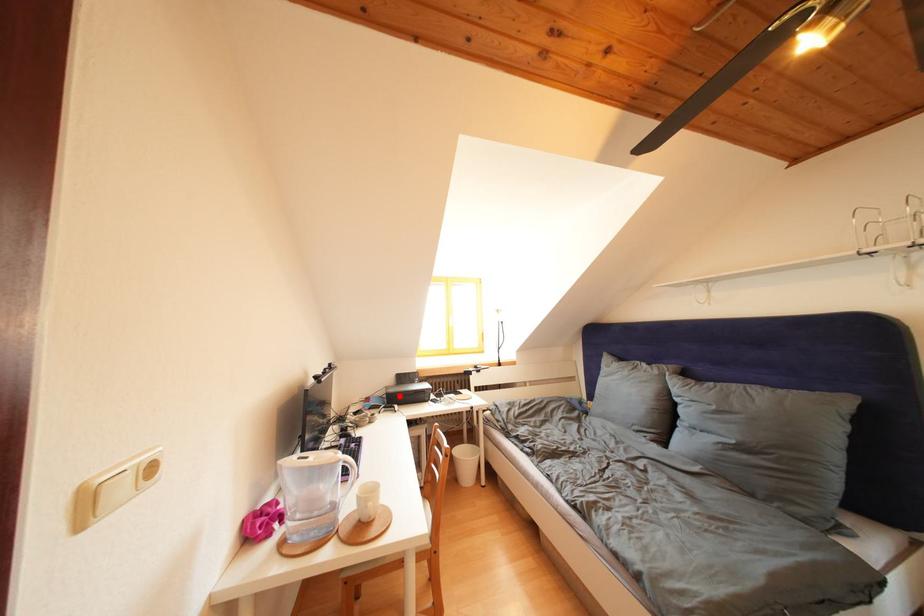
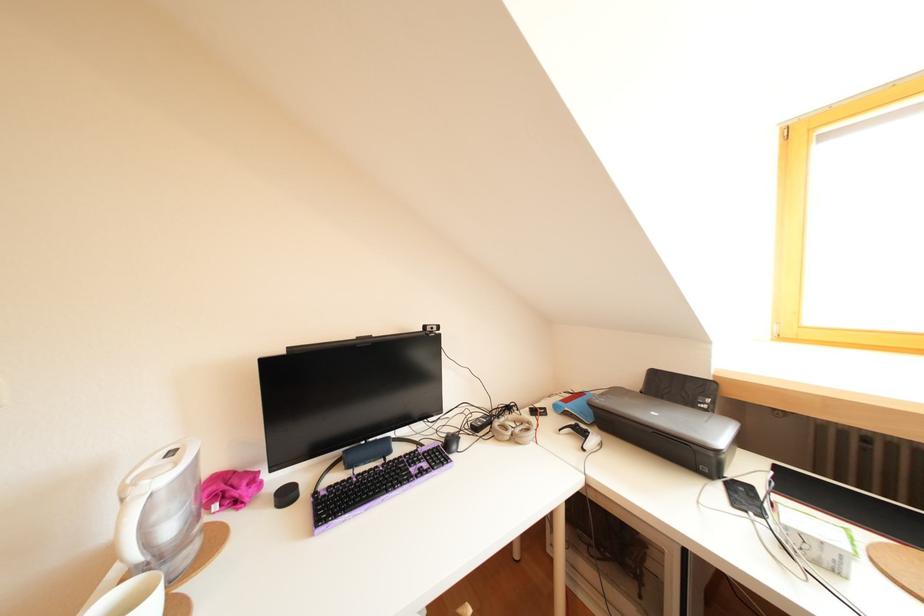
Question: I am providing you with two images of the same scene from different viewpoints. A red point is shown in image1. For the corresponding object point in image2, is it positioned nearer or farther from the camera?

Choices:
 (A) Nearer
 (B) Farther

Answer: (A)